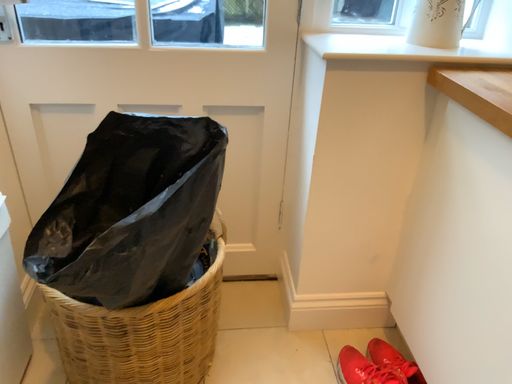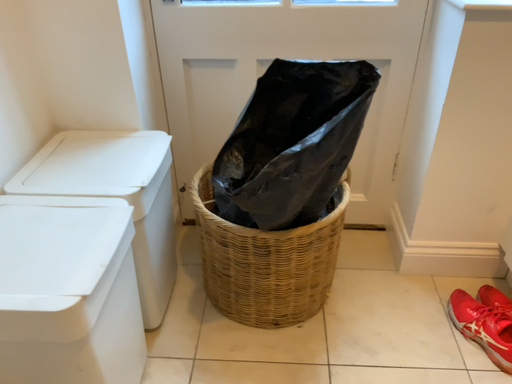
Question: How did the camera likely rotate when shooting the video?

Choices:
 (A) rotated left
 (B) rotated right

Answer: (A)